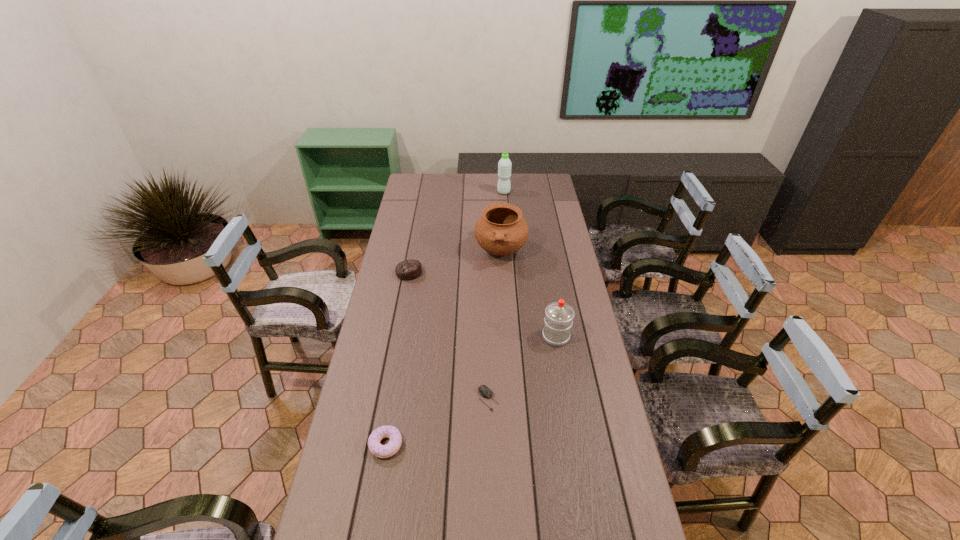
Identify the location of the farther water bottle. (504, 165).

The image size is (960, 540). In order to click on the taller water bottle in this screenshot , I will do `click(504, 165)`.

Locate an element on the screen. Image resolution: width=960 pixels, height=540 pixels. pottery is located at coordinates (501, 230).

Where is `the rightmost object`? This screenshot has width=960, height=540. the rightmost object is located at coordinates (559, 315).

Where is `the shorter water bottle`? The height and width of the screenshot is (540, 960). the shorter water bottle is located at coordinates (559, 315).

Locate an element on the screen. The width and height of the screenshot is (960, 540). beanbag is located at coordinates (407, 270).

Where is `the second shortest object`? The height and width of the screenshot is (540, 960). the second shortest object is located at coordinates (387, 431).

What are the coordinates of `doughnut` in the screenshot? It's located at (387, 431).

Image resolution: width=960 pixels, height=540 pixels. Identify the location of the shortest object. (485, 392).

I want to click on the second nearest object, so click(485, 392).